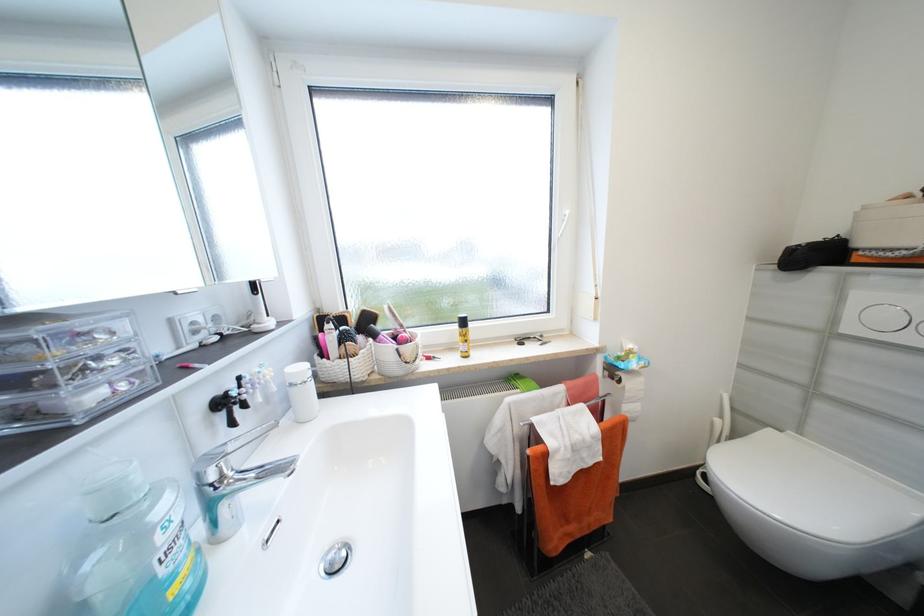
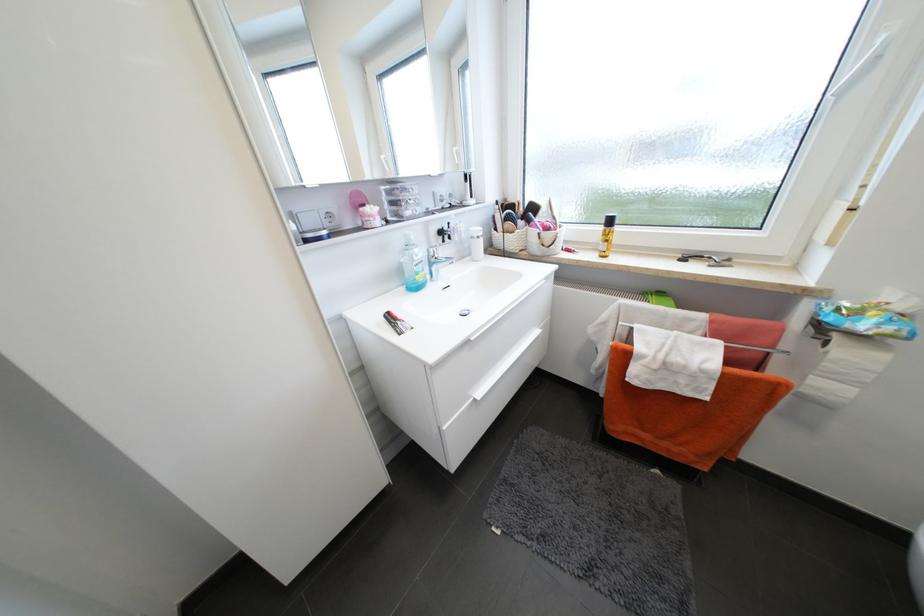
Locate, in the second image, the point that corresponds to point 403,351 in the first image.

(544, 235)